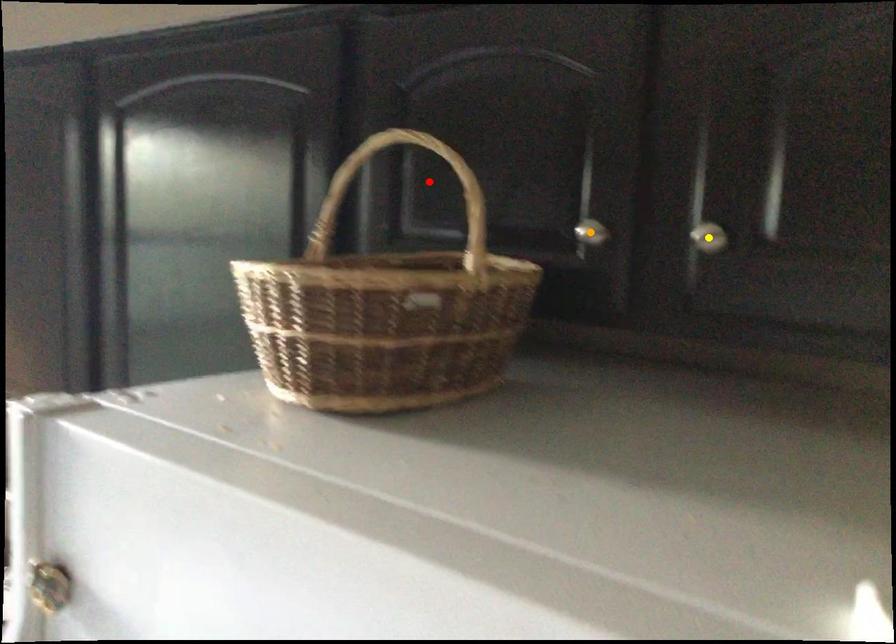
Order these from nearest to farthest:
red point, yellow point, orange point

yellow point, red point, orange point